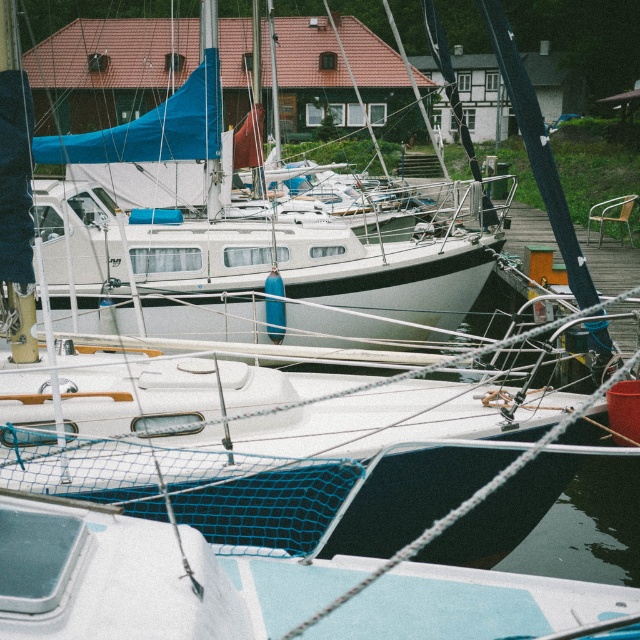
Does white matte sailboat at center appear on the left side of white matte boat at center?

Correct, you'll find white matte sailboat at center to the left of white matte boat at center.

In the scene shown: Which of these two, white matte sailboat at center or white matte boat at center, stands shorter?

white matte boat at center is shorter.

The height and width of the screenshot is (640, 640). What do you see at coordinates (269, 278) in the screenshot?
I see `white matte sailboat at center` at bounding box center [269, 278].

The height and width of the screenshot is (640, 640). I want to click on white matte sailboat at center, so point(269,278).